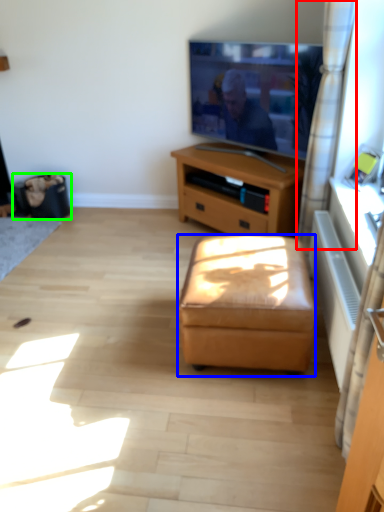
Question: Which object is the farthest from curtain (highlighted by a red box)? Choose among these: stool (highlighted by a blue box) or trash bin/can (highlighted by a green box).

Choices:
 (A) stool
 (B) trash bin/can

Answer: (B)